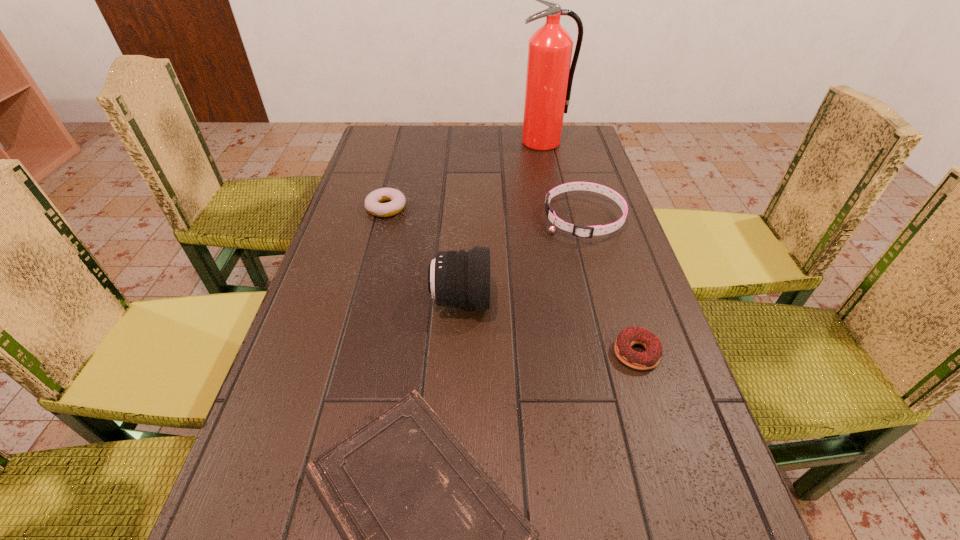
Locate an element on the screen. The height and width of the screenshot is (540, 960). the tallest object is located at coordinates (549, 77).

You are a GUI agent. You are given a task and a screenshot of the screen. Output one action in this format:
    pyautogui.click(x=<x>, y=<y>)
    Task: Click on the farthest object
    
    Given the screenshot: What is the action you would take?
    pyautogui.click(x=549, y=77)

Where is `the third nearest object`? the third nearest object is located at coordinates (461, 278).

Where is `telephoto lens`? This screenshot has width=960, height=540. telephoto lens is located at coordinates (461, 278).

In order to click on the third tallest object in this screenshot , I will do `click(581, 231)`.

The height and width of the screenshot is (540, 960). Identify the location of the farther doughnut. (373, 204).

This screenshot has width=960, height=540. In order to click on the right doughnut in this screenshot , I will do `click(648, 359)`.

Locate an element on the screen. the nearer doughnut is located at coordinates (648, 359).

Locate an element on the screen. The image size is (960, 540). free spot located at the nozzle of the tallest object is located at coordinates (561, 226).

The image size is (960, 540). In order to click on vacant space located at the front element of the fourth farthest object in this screenshot , I will do `click(516, 300)`.